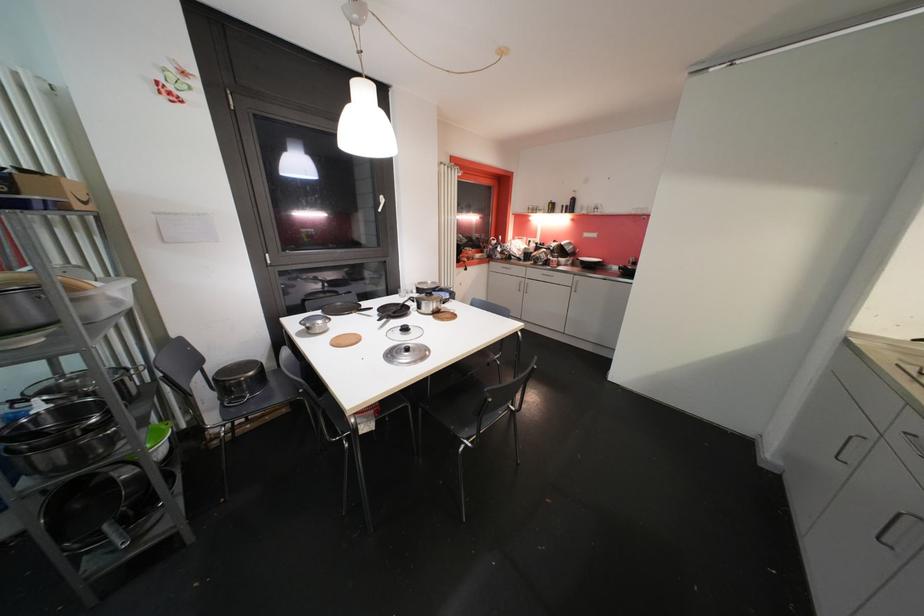
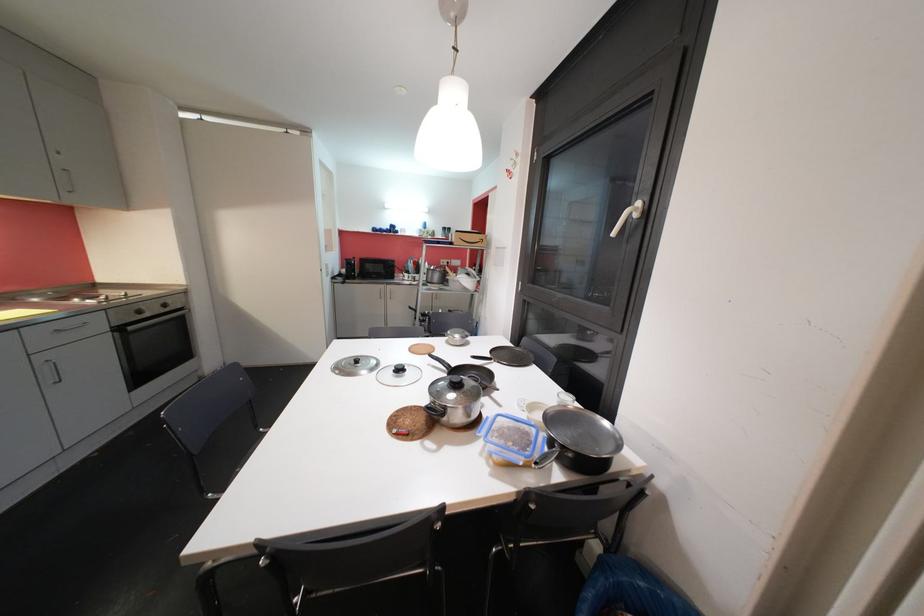
Locate, in the second image, the point that corresponds to (x=409, y=331) in the first image.

(405, 371)